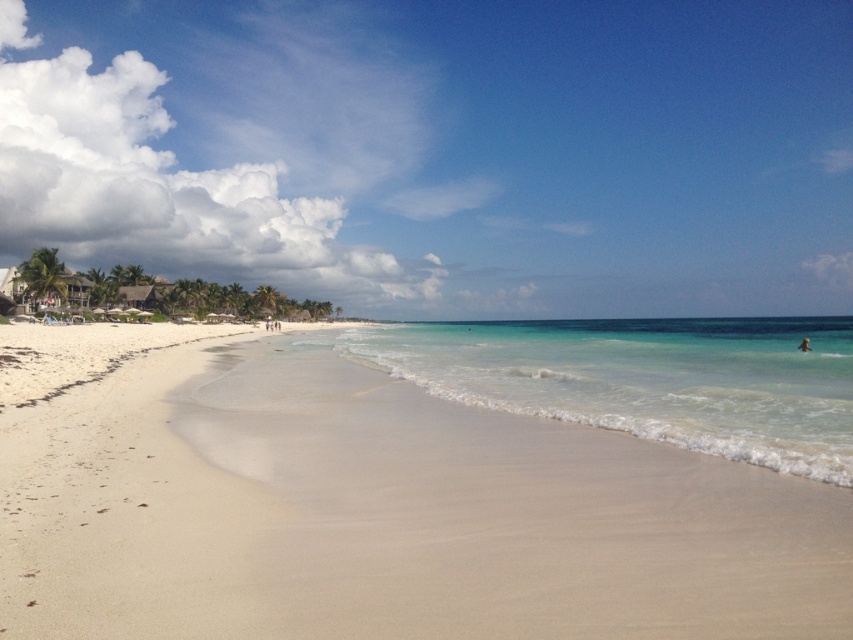
Identify the location of white sand beach at center. (387, 516).

Is clear blue water at center positioned before light skin human at lower right?

Yes, it is.

You are a GUI agent. You are given a task and a screenshot of the screen. Output one action in this format:
    pyautogui.click(x=<x>, y=<y>)
    Task: Click on the clear blue water at center
    
    Given the screenshot: What is the action you would take?
    [x=646, y=380]

Image resolution: width=853 pixels, height=640 pixels. What are the coordinates of `clear blue water at center` in the screenshot? It's located at (646, 380).

Between white sand beach at center and light skin human at lower right, which one appears on the right side from the viewer's perspective?

light skin human at lower right

Does white sand beach at center have a greater height compared to light skin human at lower right?

In fact, white sand beach at center may be shorter than light skin human at lower right.

Measure the distance between white sand beach at center and camera.

They are 4.15 meters apart.

This screenshot has height=640, width=853. I want to click on white sand beach at center, so click(x=387, y=516).